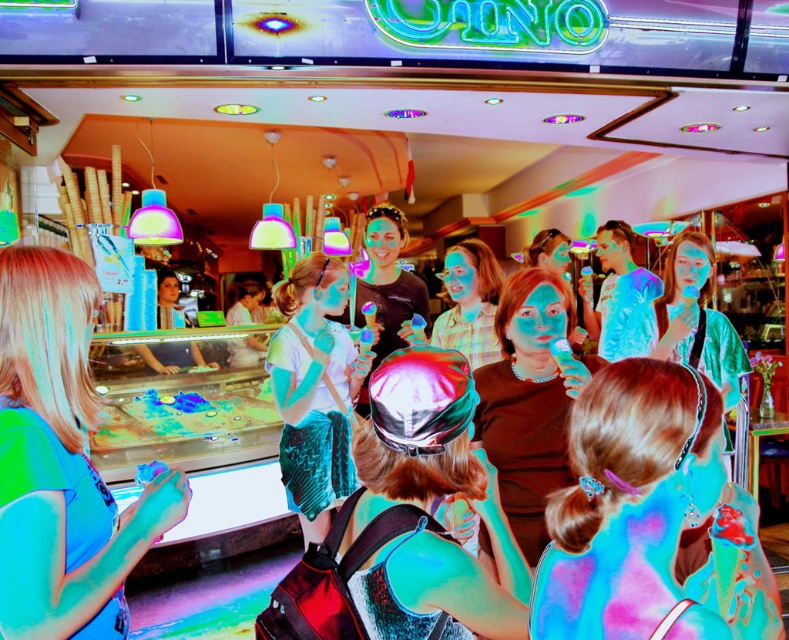
Question: Does green matte shirt at left appear over velvet teal skirt at center?

Choices:
 (A) yes
 (B) no

Answer: (A)

Question: Observing the image, what is the correct spatial positioning of shiny blue hair at center in reference to green matte shirt at left?

Choices:
 (A) below
 (B) above

Answer: (A)

Question: Which object is the farthest from the green matte shirt at left?

Choices:
 (A) velvet teal skirt at center
 (B) shiny blue hair at center

Answer: (A)

Question: Can you confirm if shiny blue hair at center is positioned below green matte shirt at left?

Choices:
 (A) no
 (B) yes

Answer: (B)

Question: Which point is farther to the camera?

Choices:
 (A) tap(681, 620)
 (B) tap(286, 346)
 (C) tap(83, 323)

Answer: (B)

Question: Which point is closer to the camera?

Choices:
 (A) shiny blue hair at center
 (B) green matte shirt at left
 (C) velvet teal skirt at center

Answer: (A)